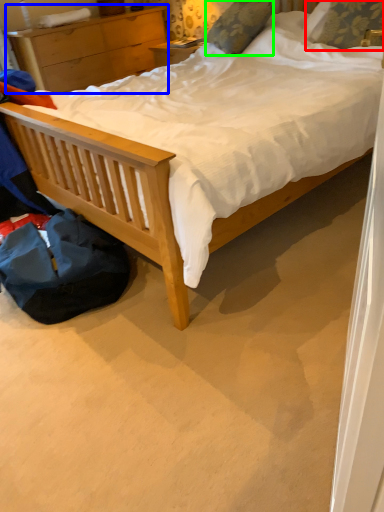
Question: Estimate the real-world distances between objects in this image. Which object is closer to pillow (highlighted by a red box), nightstand (highlighted by a blue box) or pillow (highlighted by a green box)?

Choices:
 (A) nightstand
 (B) pillow

Answer: (B)